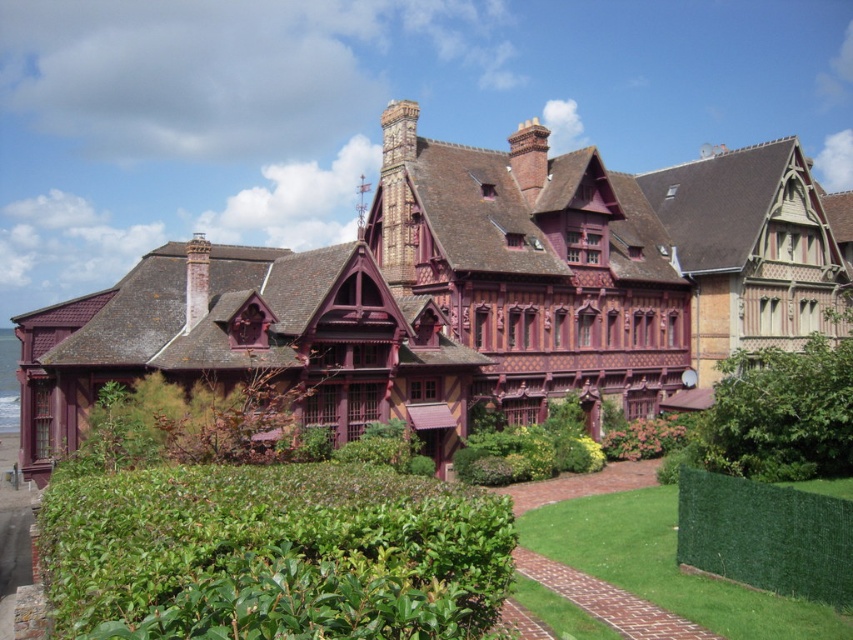
Question: Is wooden mansion at center closer to camera compared to green artificial hedge at lower right?

Choices:
 (A) no
 (B) yes

Answer: (A)

Question: Which point is farther from the camera taking this photo?

Choices:
 (A) (647, 458)
 (B) (844, 372)

Answer: (A)

Question: Among these objects, which one is farthest from the camera?

Choices:
 (A) green leafy hedge at center right
 (B) wooden mansion at center

Answer: (B)

Question: Is green leafy hedge at center right positioned before green leafy hedge at center?

Choices:
 (A) yes
 (B) no

Answer: (A)

Question: Is wooden mansion at center bigger than green artificial hedge at lower right?

Choices:
 (A) no
 (B) yes

Answer: (B)

Question: Which of the following is the farthest from the observer?

Choices:
 (A) green leafy hedge at center
 (B) wooden mansion at center
 (C) green artificial hedge at lower right

Answer: (A)